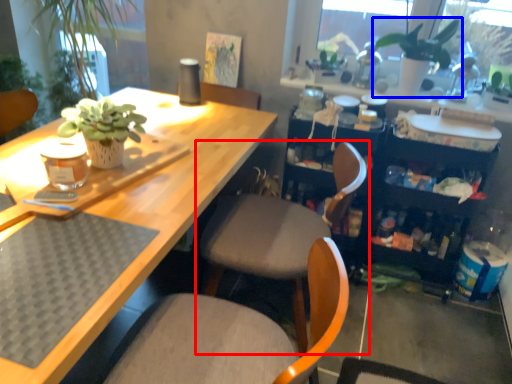
Question: Which of the following is the closest to the observer, chair (highlighted by a red box) or houseplant (highlighted by a blue box)?

Choices:
 (A) chair
 (B) houseplant

Answer: (A)